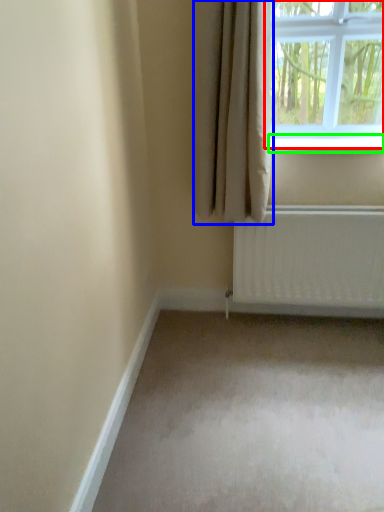
Question: Which is farther away from window (highlighted by a red box)? curtain (highlighted by a blue box) or window sill (highlighted by a green box)?

Choices:
 (A) curtain
 (B) window sill

Answer: (A)